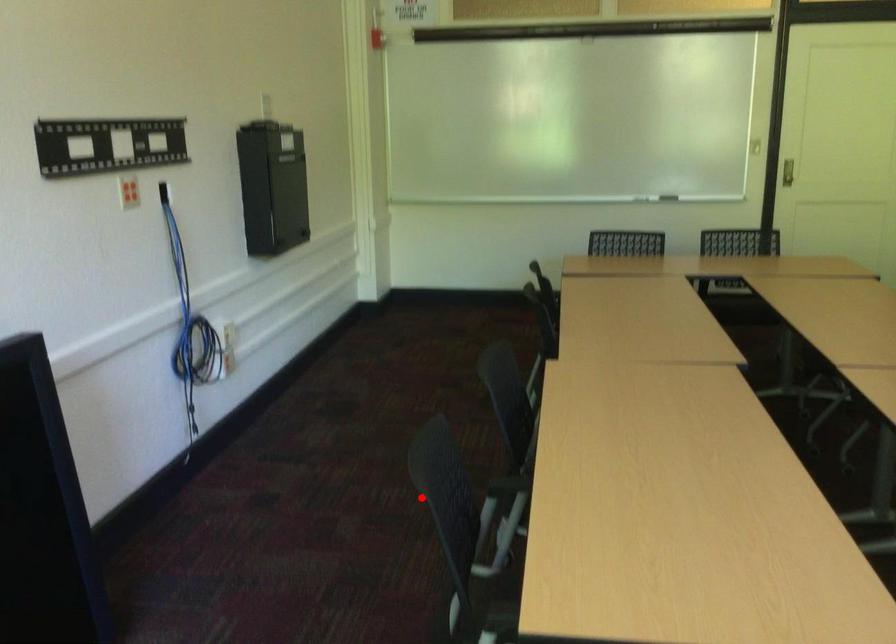
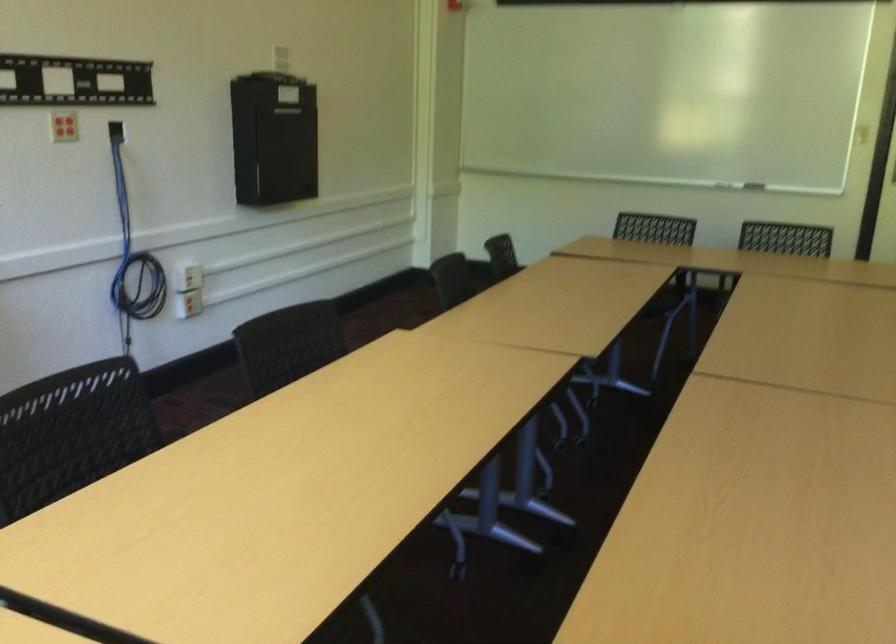
In the second image, find the point that corresponds to the highlighted location in the first image.

(71, 433)